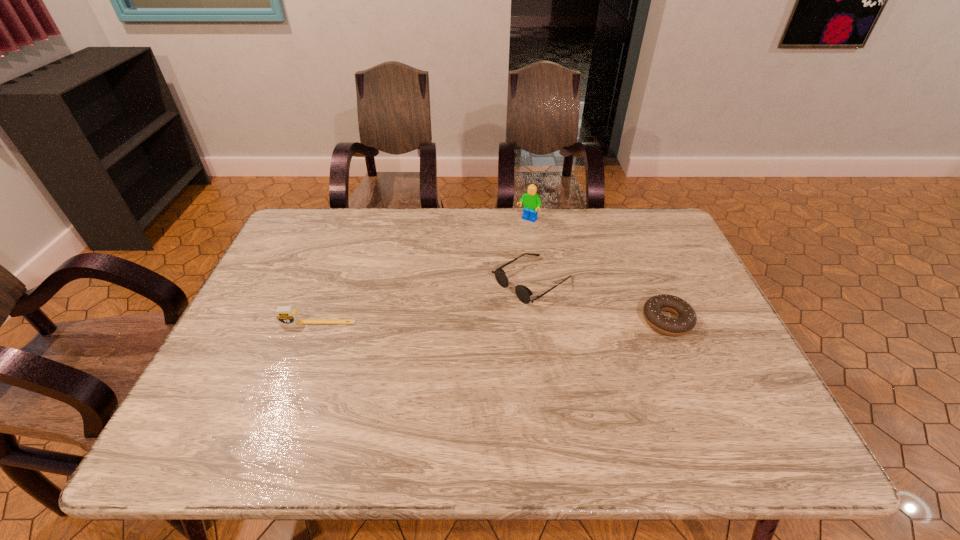
What are the coordinates of `empty location between the sunglasses and the doughnut` in the screenshot? It's located at (599, 301).

You are a GUI agent. You are given a task and a screenshot of the screen. Output one action in this format:
    pyautogui.click(x=<x>, y=<y>)
    Task: Click on the vacant space in between the sunglasses and the doughnut
    
    Given the screenshot: What is the action you would take?
    pyautogui.click(x=599, y=301)

The height and width of the screenshot is (540, 960). Identify the location of the third closest object to the doughnut. (286, 315).

Identify which object is located as the third nearest to the Lego. Please provide its 2D coordinates. Your answer should be formatted as a tuple, i.e. [(x, y)], where the tuple contains the x and y coordinates of a point satisfying the conditions above.

[(286, 315)]

At what (x,y) coordinates should I click in order to perform the action: click on vacant region that satisfies the following two spatial constraints: 1. on the front side of the doughnut; 2. on the right side of the farthest object. Please return your answer as a coordinate pair (x, y). Looking at the image, I should click on (541, 321).

Identify the location of free space that satisfies the following two spatial constraints: 1. on the back side of the sunglasses; 2. on the right side of the tallest object. (524, 220).

Where is `vacant region that satisfies the following two spatial constraints: 1. on the front side of the rightmost object; 2. on the right side of the sunglasses`? vacant region that satisfies the following two spatial constraints: 1. on the front side of the rightmost object; 2. on the right side of the sunglasses is located at coordinates (537, 321).

You are a GUI agent. You are given a task and a screenshot of the screen. Output one action in this format:
    pyautogui.click(x=<x>, y=<y>)
    Task: Click on the free space that satisfies the following two spatial constraints: 1. on the front side of the rightmost object; 2. on the left side of the sunglasses
    This screenshot has height=540, width=960.
    Given the screenshot: What is the action you would take?
    tap(537, 321)

This screenshot has height=540, width=960. Identify the location of vacant space that satisfies the following two spatial constraints: 1. on the front side of the farthest object; 2. on the right side of the doughnut. (541, 321).